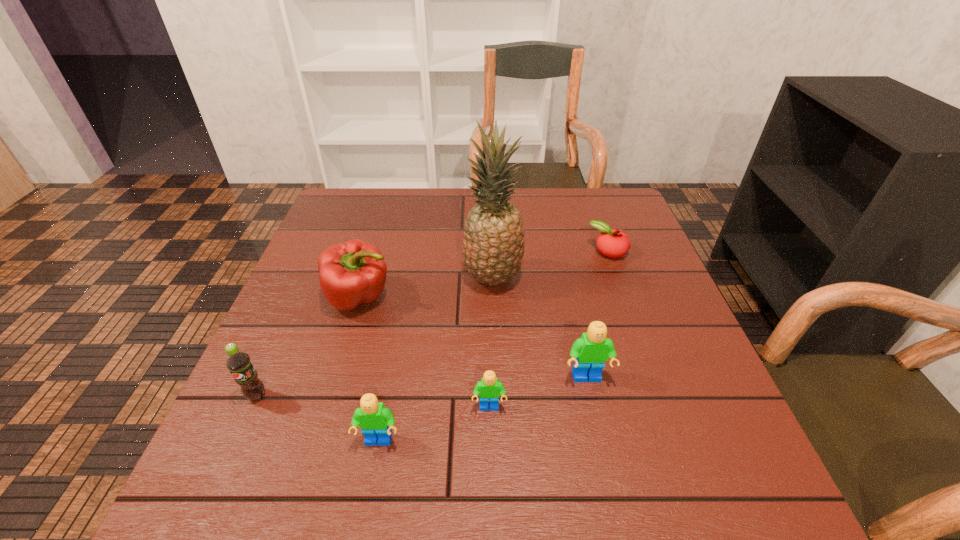
Please point a vacant point for placing a Lego on the right. Please provide its 2D coordinates. Your answer should be formatted as a tuple, i.e. [(x, y)], where the tuple contains the x and y coordinates of a point satisfying the conditions above.

[(674, 352)]